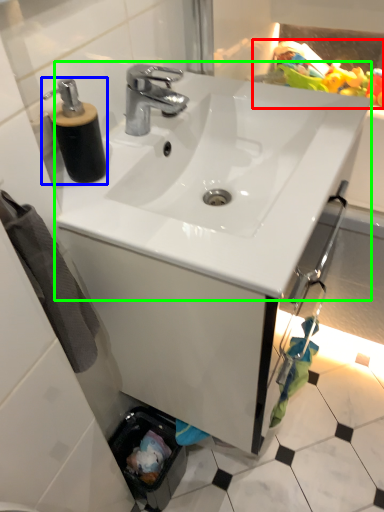
Question: Which object is positioned farthest from toy (highlighted by a red box)? Select from soap dispenser (highlighted by a blue box) and sink (highlighted by a green box).

Choices:
 (A) soap dispenser
 (B) sink

Answer: (A)